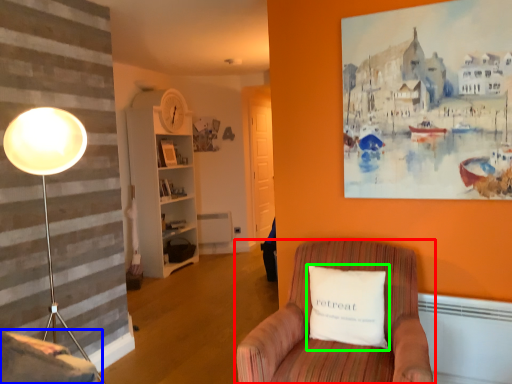
Question: Which is farther away from chair (highlighted by a red box)? swivel chair (highlighted by a blue box) or pillow (highlighted by a green box)?

Choices:
 (A) swivel chair
 (B) pillow

Answer: (A)